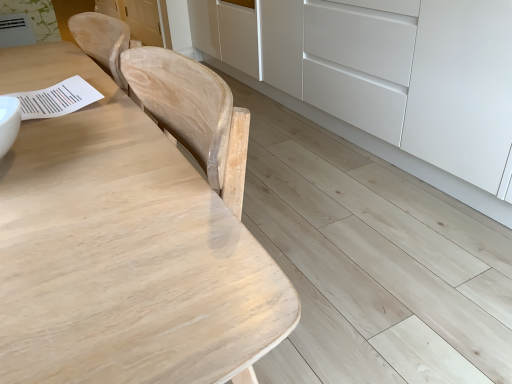
Question: In the image, is white matte cabinet at lower right on the left side or the right side of natural wood table at upper left?

Choices:
 (A) left
 (B) right

Answer: (B)

Question: In the image, is white matte cabinet at lower right positioned in front of or behind natural wood table at upper left?

Choices:
 (A) front
 (B) behind

Answer: (B)

Question: Is white matte cabinet at lower right inside the boundaries of natural wood table at upper left, or outside?

Choices:
 (A) outside
 (B) inside

Answer: (A)

Question: From a real-world perspective, relative to white matte cabinet at lower right, is natural wood table at upper left vertically above or below?

Choices:
 (A) below
 (B) above

Answer: (B)

Question: Is point (62, 135) closer or farther from the camera than point (295, 9)?

Choices:
 (A) closer
 (B) farther

Answer: (A)

Question: From the image's perspective, relative to white matte cabinet at lower right, is natural wood table at upper left above or below?

Choices:
 (A) below
 (B) above

Answer: (A)

Question: Considering their positions, is natural wood table at upper left located in front of or behind white matte cabinet at lower right?

Choices:
 (A) behind
 (B) front

Answer: (B)